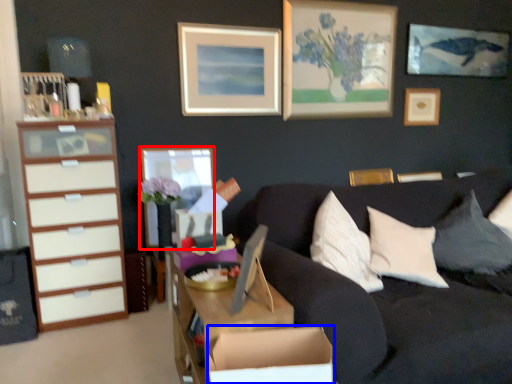
Question: Among these objects, which one is farthest to the camera, picture frame (highlighted by a red box) or cardboard box (highlighted by a blue box)?

Choices:
 (A) picture frame
 (B) cardboard box

Answer: (A)